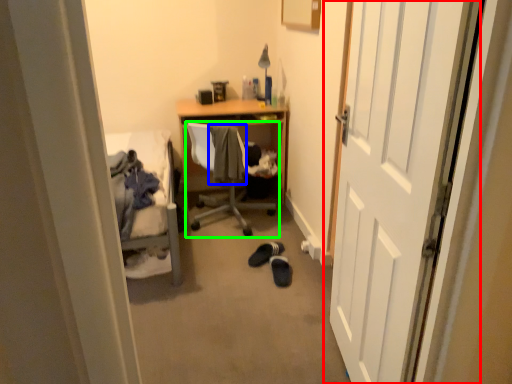
Question: Estimate the real-world distances between objects in this image. Which object is farther from door (highlighted by a red box), clothing (highlighted by a blue box) or chair (highlighted by a green box)?

Choices:
 (A) clothing
 (B) chair

Answer: (B)